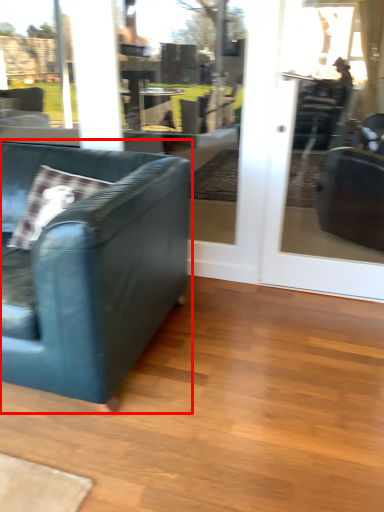
Question: From the image's perspective, where is studio couch (annotated by the red box) located relative to screen door?

Choices:
 (A) above
 (B) below

Answer: (B)